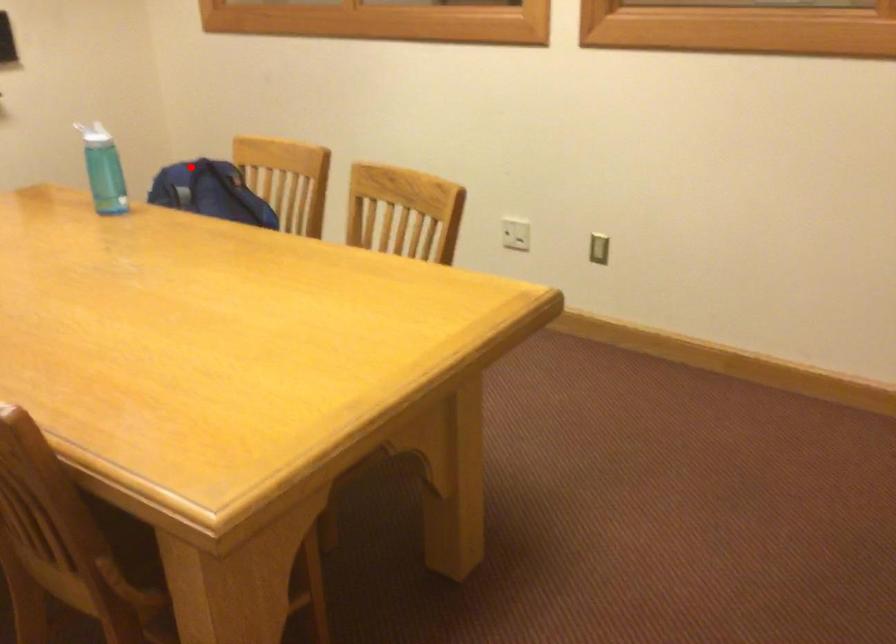
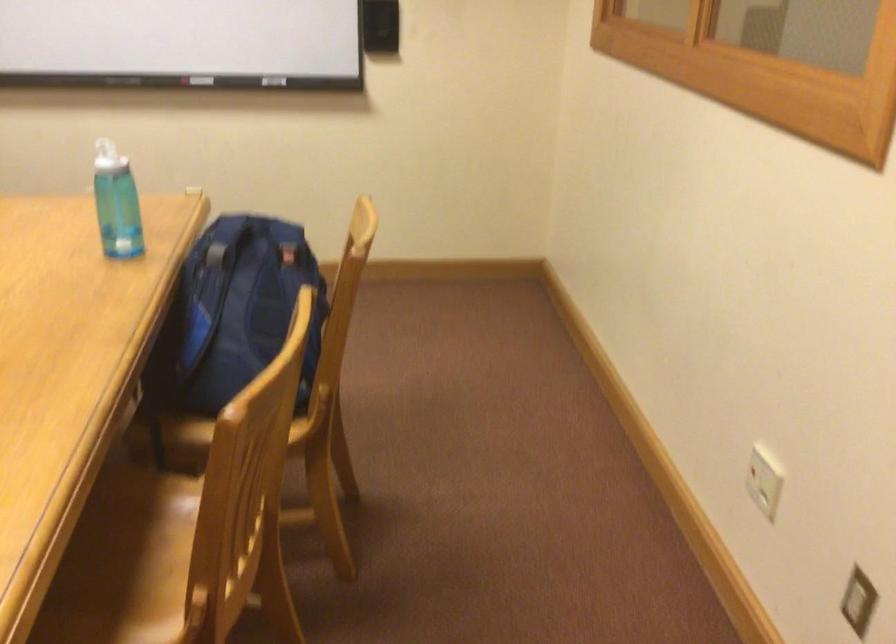
Question: I am providing you with two images of the same scene from different viewpoints. A red point is marked on the first image. Can you still see the location of the red point in image 2?

Choices:
 (A) Yes
 (B) No

Answer: (A)